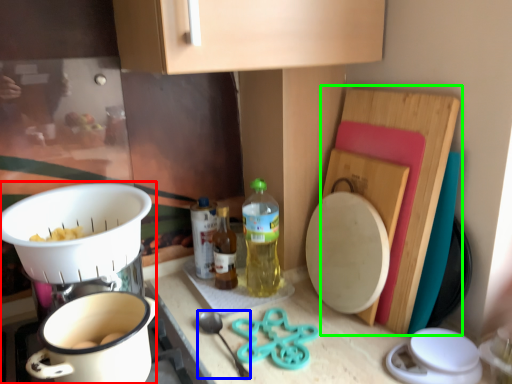
Question: Estimate the real-world distances between objects in this image. Which object is closer to appliance (highlighted by a red box), utensil (highlighted by a blue box) or cutting board (highlighted by a green box)?

Choices:
 (A) utensil
 (B) cutting board

Answer: (A)